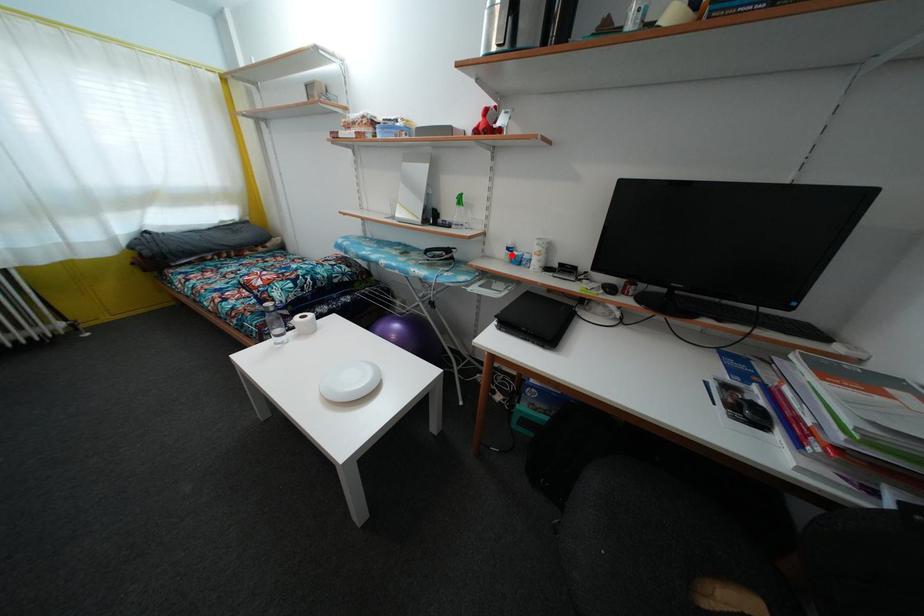
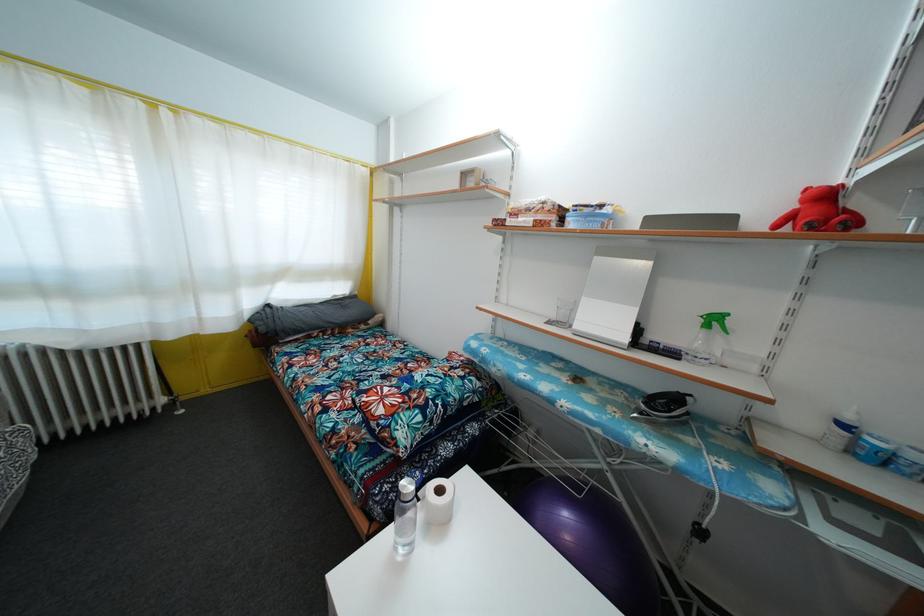
Locate, in the second image, the point that corresponds to the highlighted location in the first image.

(848, 432)